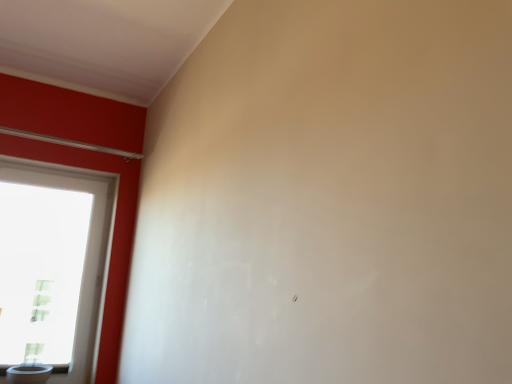
The width and height of the screenshot is (512, 384). What do you see at coordinates (52, 265) in the screenshot?
I see `transparent glass window at left` at bounding box center [52, 265].

At what (x,y) coordinates should I click in order to perform the action: click on transparent glass window at left. Please return your answer as a coordinate pair (x, y). The height and width of the screenshot is (384, 512). Looking at the image, I should click on (52, 265).

Find the location of `transparent glass window at left`. transparent glass window at left is located at coordinates (52, 265).